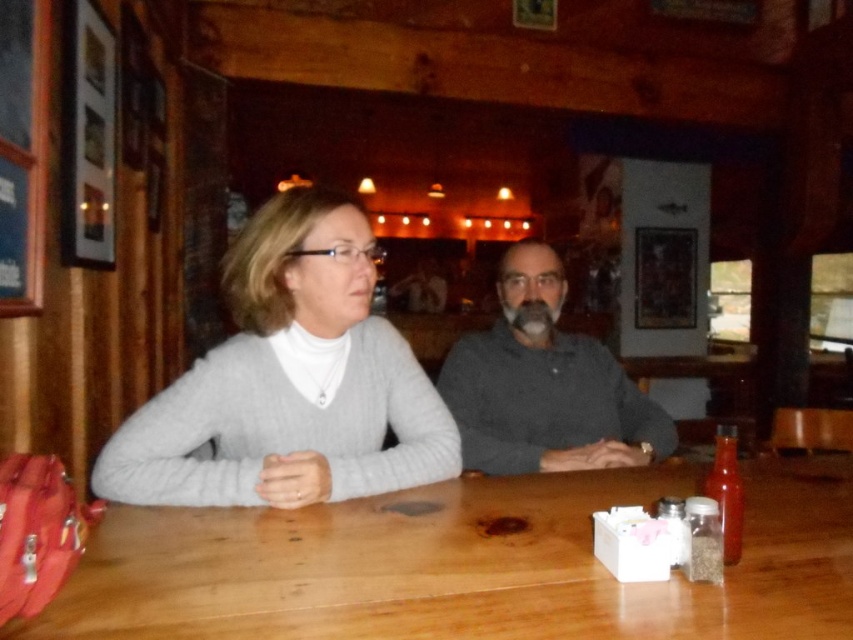
Question: Is wooden table at center thinner than gray knitted sweater at center?

Choices:
 (A) yes
 (B) no

Answer: (B)

Question: Which point is closer to the camera?

Choices:
 (A) click(215, 477)
 (B) click(527, 436)
 (C) click(113, 616)

Answer: (C)

Question: Estimate the real-world distances between objects in this image. Which object is farther from the gray knitted sweater at center?

Choices:
 (A) wooden table at center
 (B) gray matte sweater at center

Answer: (B)

Question: Can you confirm if wooden table at center is smaller than gray knitted sweater at center?

Choices:
 (A) no
 (B) yes

Answer: (B)

Question: Can you confirm if wooden table at center is positioned above gray matte sweater at center?

Choices:
 (A) no
 (B) yes

Answer: (A)

Question: Among these points, which one is farthest from the camera?

Choices:
 (A) (483, 518)
 (B) (263, 321)
 (C) (519, 436)

Answer: (C)